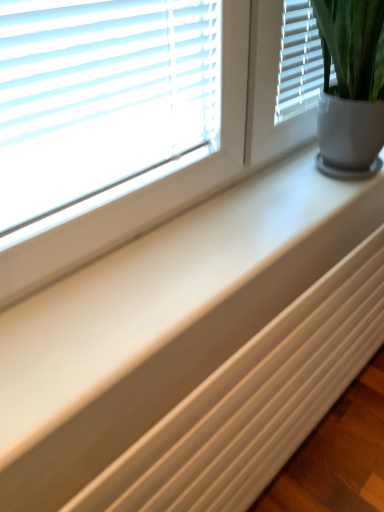
The width and height of the screenshot is (384, 512). What do you see at coordinates (254, 401) in the screenshot? I see `white matte radiator at lower center` at bounding box center [254, 401].

In the scene shown: What is the approximate width of white matte radiator at lower center?

It is 3.11 inches.

Measure the distance between point (363, 344) and camera.

They are 3.89 feet apart.

Identify the location of white matte radiator at lower center. The image size is (384, 512). (254, 401).

Find the location of `white matte radiator at lower center`. white matte radiator at lower center is located at coordinates (254, 401).